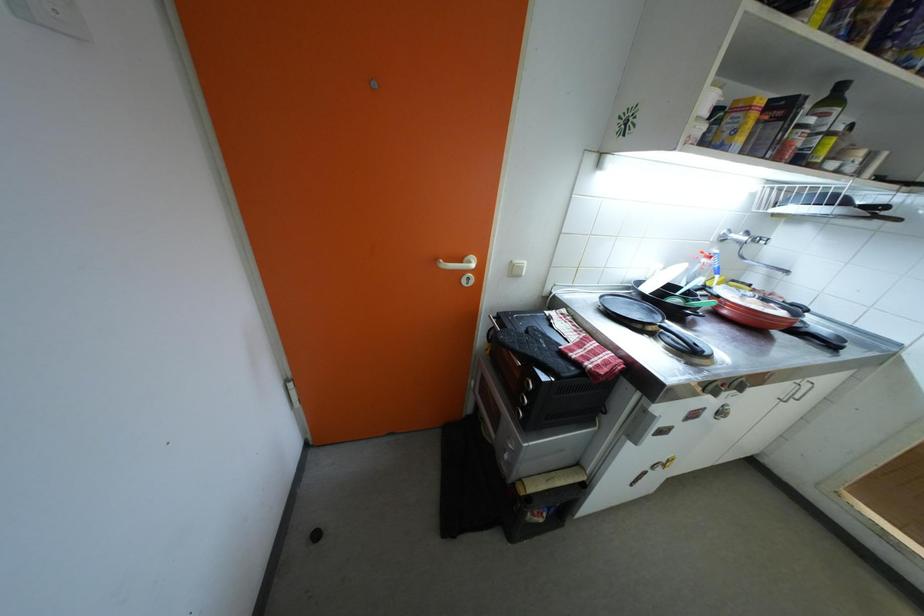
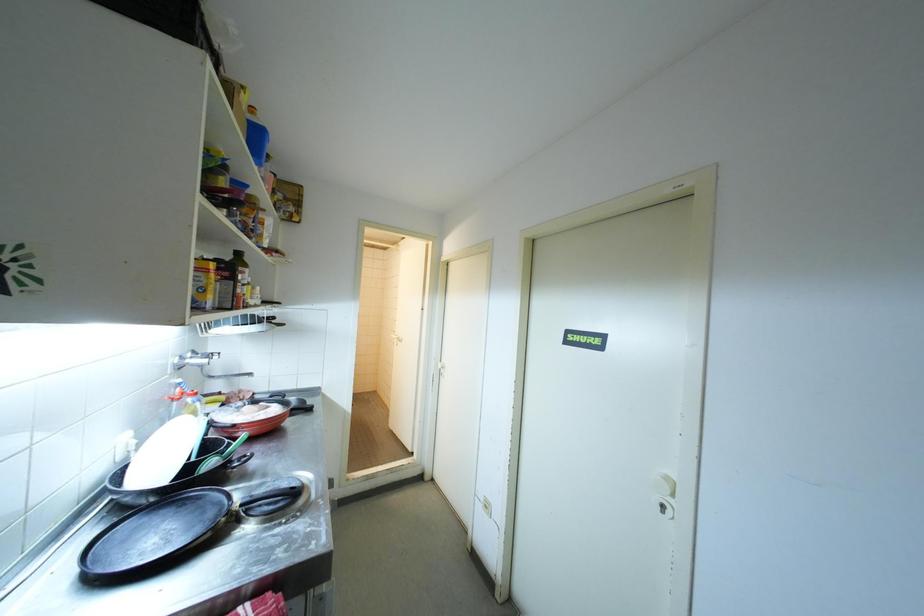
Question: Based on the continuous images, in which direction is the camera rotating? Reply with the corresponding letter.

Choices:
 (A) Left
 (B) Right
 (C) Up
 (D) Down

Answer: (B)